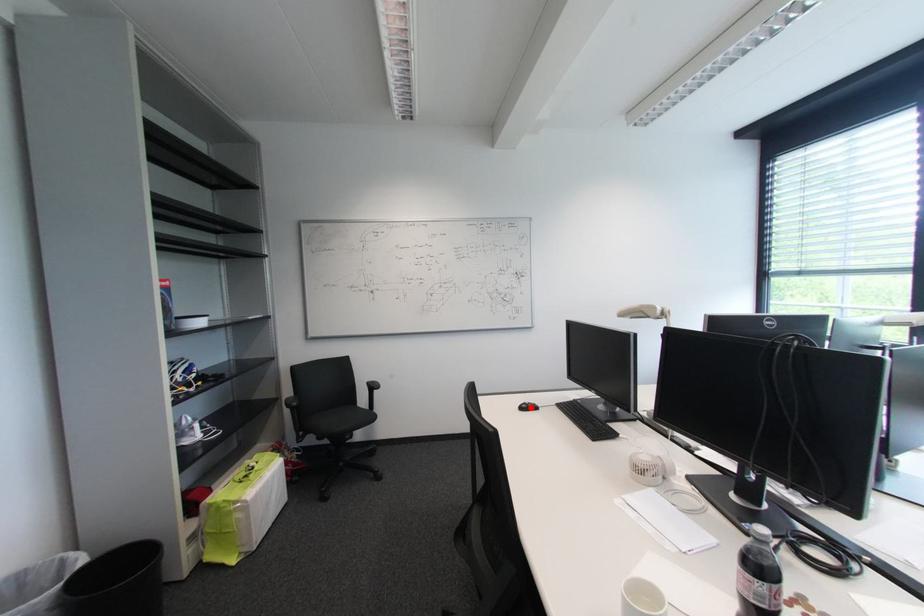
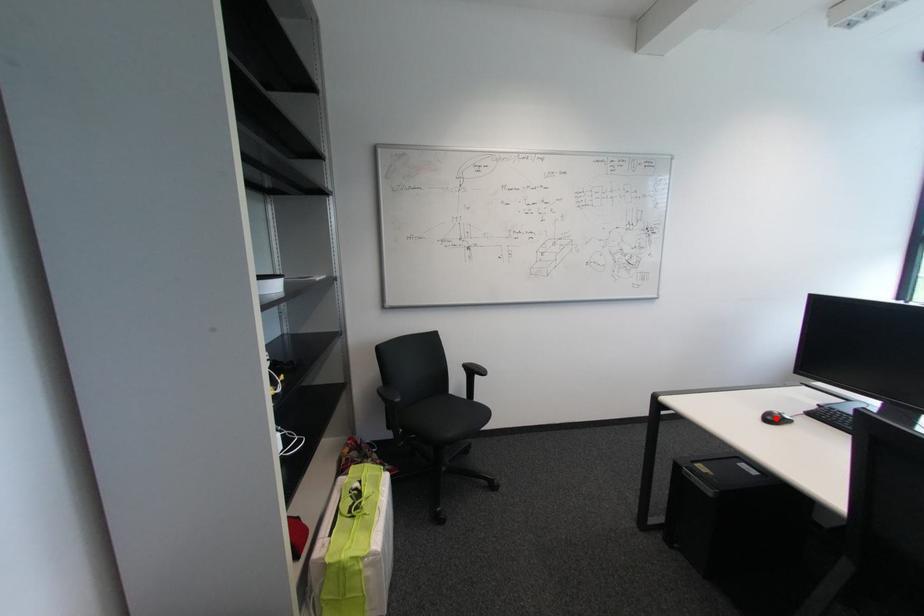
I am providing you with two images of the same scene from different viewpoints. A red point is marked on the first image and another point is marked on the second image. Are the points marked in image1 and image2 representing the same 3D position?

Yes